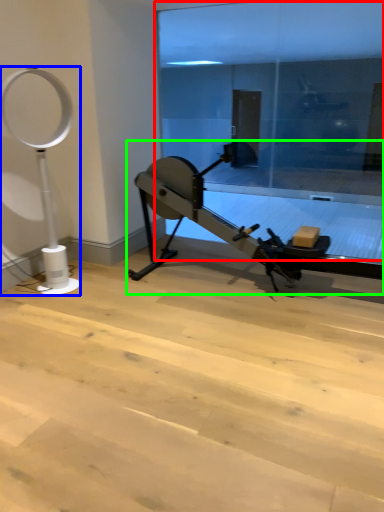
Question: Which object is positioned closest to glass door (highlighted by a red box)? Select from basketball hoop (highlighted by a blue box) and stationary bicycle (highlighted by a green box).

Choices:
 (A) basketball hoop
 (B) stationary bicycle

Answer: (B)